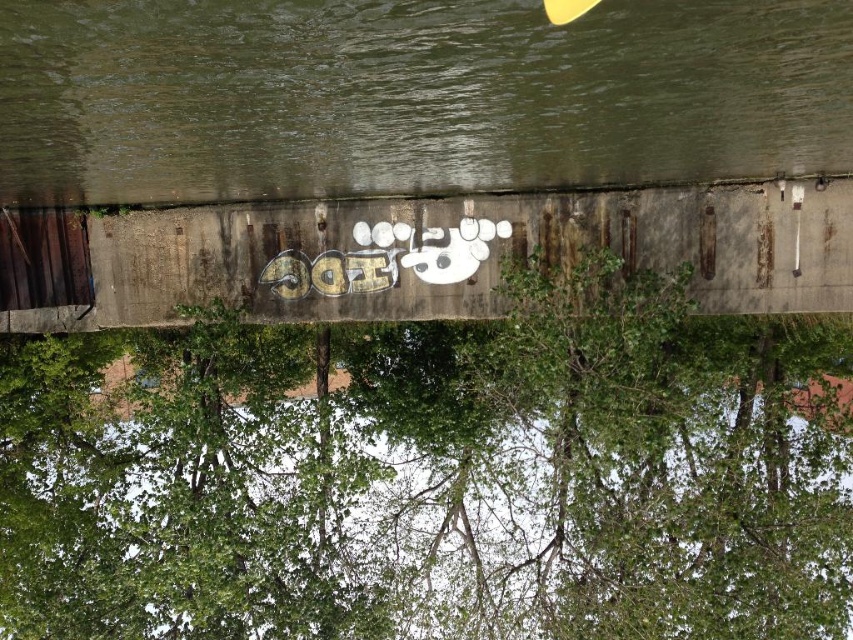
Question: Which point is farther to the camera?

Choices:
 (A) (393, 579)
 (B) (178, 6)

Answer: (A)

Question: Can you confirm if green leafy tree at center is smaller than green concrete river at center?

Choices:
 (A) no
 (B) yes

Answer: (A)

Question: Which object appears closest to the camera in this image?

Choices:
 (A) green concrete river at center
 (B) green leafy tree at center

Answer: (A)

Question: Is green leafy tree at center in front of green concrete river at center?

Choices:
 (A) no
 (B) yes

Answer: (A)

Question: Is green leafy tree at center positioned in front of green concrete river at center?

Choices:
 (A) no
 (B) yes

Answer: (A)